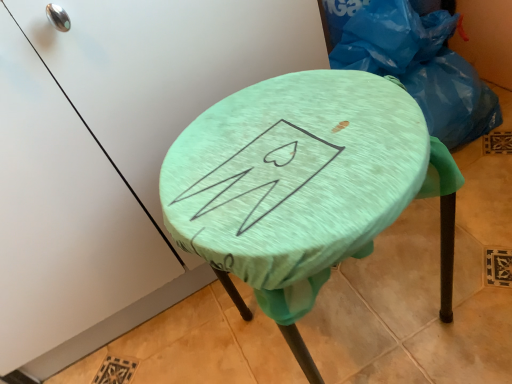
Where is `free location above mint fabric-covered stool at center (from a real-world perspective)`? free location above mint fabric-covered stool at center (from a real-world perspective) is located at coordinates (298, 157).